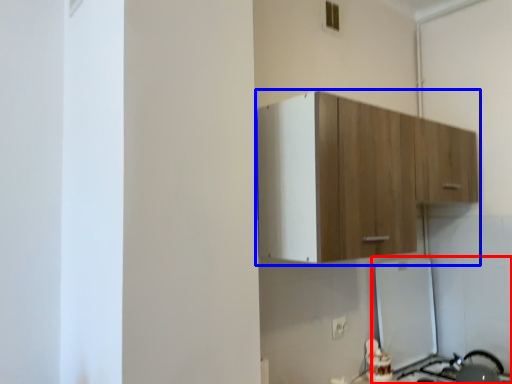
Question: Among these objects, which one is farthest to the camera, appliance (highlighted by a red box) or cabinetry (highlighted by a blue box)?

Choices:
 (A) appliance
 (B) cabinetry

Answer: (A)